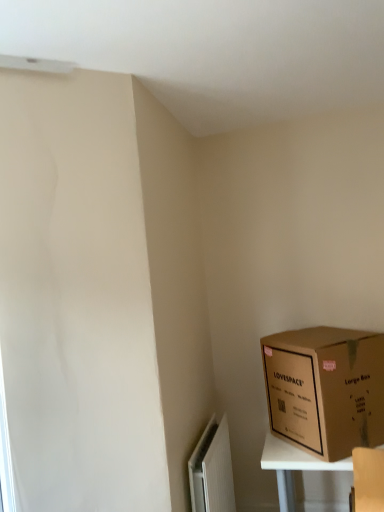
Question: Considering their positions, is white matte radiator at lower left located in front of or behind brown cardboard box at lower right?

Choices:
 (A) front
 (B) behind

Answer: (A)

Question: Considering the positions of point (192, 498) and point (271, 415), is point (192, 498) closer or farther from the camera than point (271, 415)?

Choices:
 (A) closer
 (B) farther

Answer: (A)

Question: From the image's perspective, is white matte radiator at lower left positioned above or below brown cardboard box at lower right?

Choices:
 (A) below
 (B) above

Answer: (A)

Question: In the image, is brown cardboard box at lower right positioned in front of or behind white matte radiator at lower left?

Choices:
 (A) behind
 (B) front

Answer: (A)

Question: From the image's perspective, relative to white matte radiator at lower left, is brown cardboard box at lower right above or below?

Choices:
 (A) above
 (B) below

Answer: (A)

Question: Do you think brown cardboard box at lower right is within white matte radiator at lower left, or outside of it?

Choices:
 (A) outside
 (B) inside

Answer: (A)

Question: Is brown cardboard box at lower right taller or shorter than white matte radiator at lower left?

Choices:
 (A) tall
 (B) short

Answer: (B)